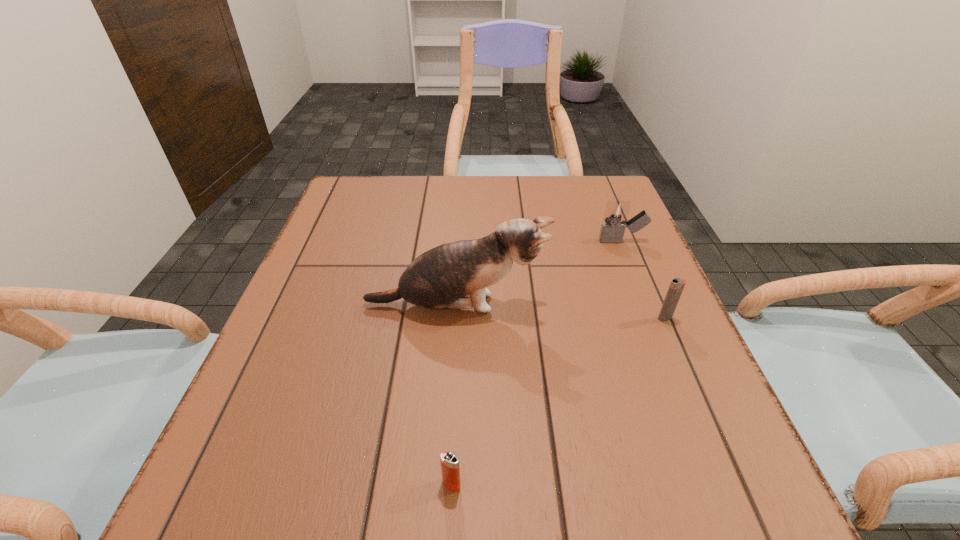
The width and height of the screenshot is (960, 540). I want to click on object present at the left edge, so click(x=444, y=277).

What are the coordinates of `free space at the far edge of the desktop` in the screenshot? It's located at (476, 203).

I want to click on blank space at the near edge, so click(x=395, y=489).

Locate an element on the screen. vacant region at the left edge of the desktop is located at coordinates (333, 244).

Identify the location of blank space at the right edge of the desktop. The image size is (960, 540). (625, 418).

The height and width of the screenshot is (540, 960). In the image, there is a desktop. In order to click on vacant area at the far right corner in this screenshot , I will do `click(592, 179)`.

Where is `blank space at the near right corner`? Image resolution: width=960 pixels, height=540 pixels. blank space at the near right corner is located at coordinates (705, 535).

The image size is (960, 540). In order to click on free spot between the second nearest igniter and the shortest object in this screenshot , I will do `click(558, 401)`.

The width and height of the screenshot is (960, 540). I want to click on vacant area that lies between the leftmost igniter and the farthest object, so click(x=537, y=363).

Find the location of a particular element. The height and width of the screenshot is (540, 960). vacant region between the cat and the farthest igniter is located at coordinates (539, 273).